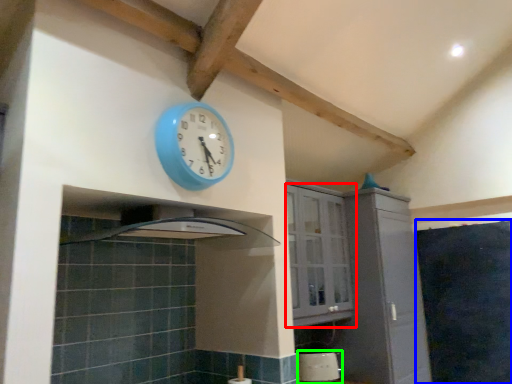
Question: Which object is positioned closest to cabinetry (highlighted by a red box)? Select from dark (highlighted by a blue box) and appliance (highlighted by a green box).

Choices:
 (A) dark
 (B) appliance

Answer: (B)